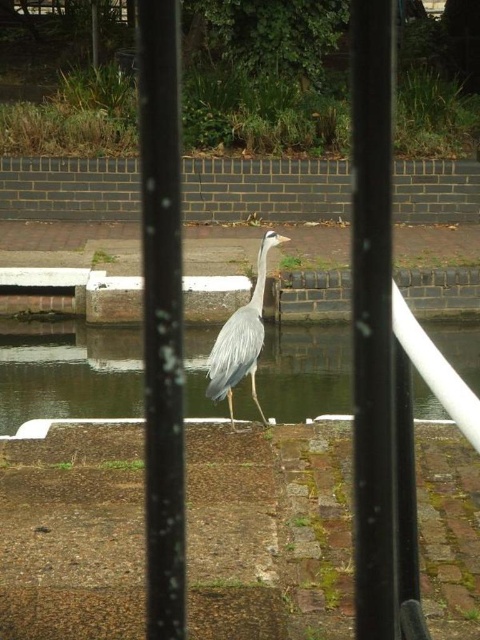
Question: Which point appears closest to the camera in this image?

Choices:
 (A) (55, 413)
 (B) (262, 307)

Answer: (B)

Question: Is clear water at center smaller than gray feathered heron at center?

Choices:
 (A) no
 (B) yes

Answer: (A)

Question: Among these objects, which one is nearest to the camera?

Choices:
 (A) clear water at center
 (B) gray feathered heron at center

Answer: (B)

Question: Does clear water at center have a smaller size compared to gray feathered heron at center?

Choices:
 (A) yes
 (B) no

Answer: (B)

Question: Does clear water at center come behind gray feathered heron at center?

Choices:
 (A) no
 (B) yes

Answer: (B)